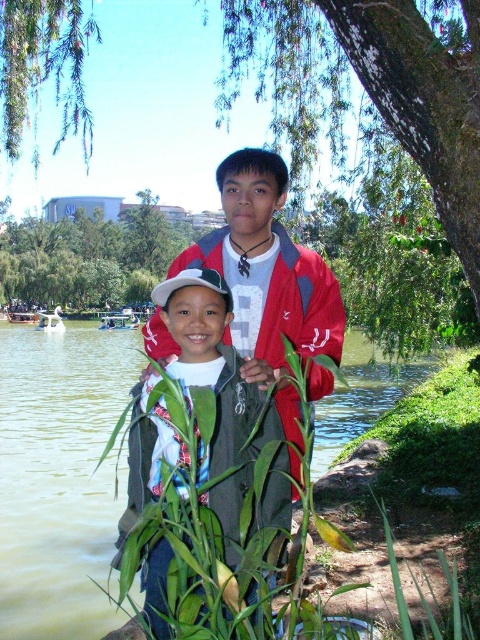
Who is more forward, (323, 467) or (92, 269)?

Point (323, 467) is more forward.

Is point (33, 616) farther from viewer compared to point (71, 241)?

That is False.

Find the location of a particular element. Image resolution: width=480 pixels, height=640 pixels. green leafy plant at center is located at coordinates (60, 476).

Does green leafy tree at center have a lesser height compared to green leafy branches at upper left?

No.

Locate an element on the screen. This screenshot has width=480, height=640. green leafy tree at center is located at coordinates (88, 257).

Locate an element on the screen. green leafy tree at center is located at coordinates (88, 257).

Which is below, green fabric jacket at center or green leafy tree at center?

green fabric jacket at center is below.

How much distance is there between green fabric jacket at center and green leafy tree at center?

The distance of green fabric jacket at center from green leafy tree at center is 135.66 meters.

This screenshot has width=480, height=640. Identify the location of green fabric jacket at center. (216, 392).

At what (x,y) coordinates should I click in order to perform the action: click on green fabric jacket at center. Please return your answer as a coordinate pair (x, y). This screenshot has height=640, width=480. Looking at the image, I should click on pyautogui.click(x=216, y=392).